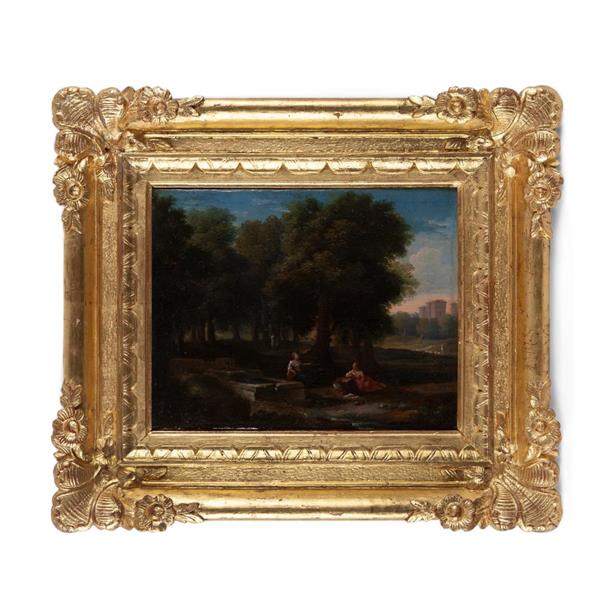
In order to click on dark part of bottom left hand area of painting in this screenshot , I will do `click(160, 424)`.